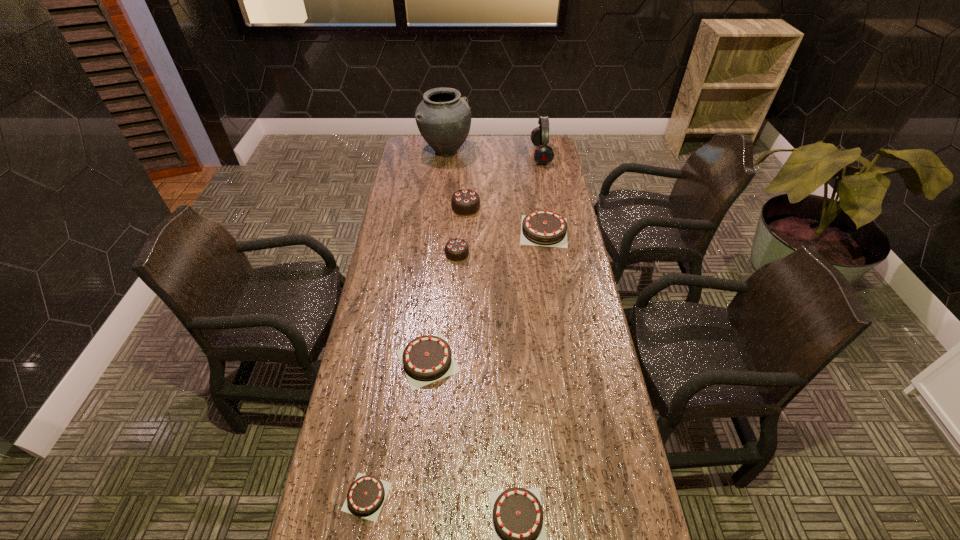
At what (x,y) coordinates should I click in order to perform the action: click on free spot located 0.140m on the back of the third smallest brown chocolate cake. Please return your answer as a coordinate pair (x, y). The height and width of the screenshot is (540, 960). Looking at the image, I should click on (434, 300).

The height and width of the screenshot is (540, 960). I want to click on free point located 0.230m on the right of the smallest brown chocolate cake, so click(x=487, y=496).

The height and width of the screenshot is (540, 960). I want to click on urn located at the far edge, so click(443, 118).

Where is `earphone at the far edge`? The height and width of the screenshot is (540, 960). earphone at the far edge is located at coordinates (543, 154).

In order to click on urn located in the left edge section of the desktop in this screenshot , I will do `click(443, 118)`.

Image resolution: width=960 pixels, height=540 pixels. What are the coordinates of `earphone that is at the right edge` in the screenshot? It's located at click(543, 154).

Image resolution: width=960 pixels, height=540 pixels. I want to click on chocolate cake present at the right edge, so click(x=542, y=227).

I want to click on object situated at the far left corner, so click(443, 118).

Where is `object that is at the far right corner`? Image resolution: width=960 pixels, height=540 pixels. object that is at the far right corner is located at coordinates (543, 154).

This screenshot has width=960, height=540. Identify the location of vacant space at the far edge of the desktop. (491, 147).